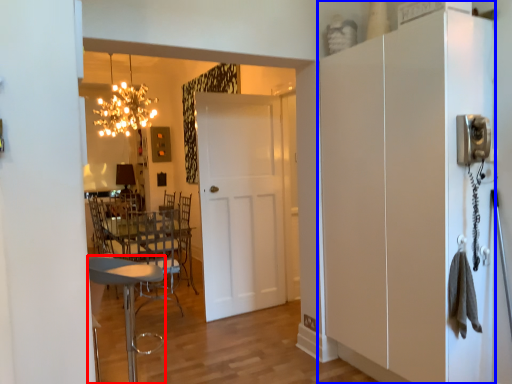
Question: Among these objects, which one is farthest to the camera, chair (highlighted by a red box) or cabinetry (highlighted by a blue box)?

Choices:
 (A) chair
 (B) cabinetry

Answer: (A)